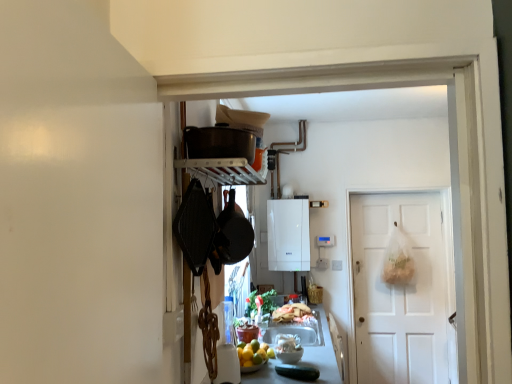
Question: Do you think matte black pot at upper center, placed as the first appliance when sorted from front to back, is within white glossy boiler at center, which is the 2th appliance from front to back, or outside of it?

Choices:
 (A) outside
 (B) inside

Answer: (A)

Question: In the image, is matte black pot at upper center, the 2th appliance in the bottom-to-top sequence, positioned in front of or behind white glossy boiler at center, which is the 2th appliance from front to back?

Choices:
 (A) front
 (B) behind

Answer: (A)

Question: Estimate the real-world distances between objects in this image. Which object is closer to the smooth gray countertop at center?

Choices:
 (A) white glossy bowl at center, marked as the first food in a front-to-back arrangement
 (B) shiny plastic bag of bread at center, which is counted as the 2th food, starting from the front
 (C) black matte wok at center
 (D) matte black pot at upper center, the 2th appliance in the bottom-to-top sequence
 (E) white matte door at center

Answer: (A)

Question: Estimate the real-world distances between objects in this image. Which object is closer to the smooth gray countertop at center?

Choices:
 (A) white glossy boiler at center, the first appliance positioned from the bottom
 (B) white glossy bowl at center, marked as the first food in a front-to-back arrangement
 (C) shiny plastic bag of bread at center, which is counted as the 2th food, starting from the front
 (D) white matte door at center
 (E) matte black pot at upper center, which appears as the first appliance when viewed from the top

Answer: (B)